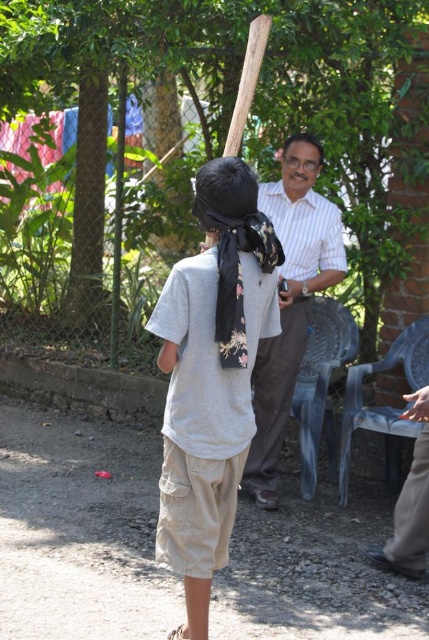
Between white striped shirt at center and wooden baseball bat at upper center, which one appears on the left side from the viewer's perspective?

wooden baseball bat at upper center is more to the left.

Who is taller, white striped shirt at center or wooden baseball bat at upper center?

Standing taller between the two is white striped shirt at center.

Find the location of a particular element. Image resolution: width=429 pixels, height=640 pixels. white striped shirt at center is located at coordinates (290, 300).

Find the location of a particular element. This screenshot has height=640, width=429. white striped shirt at center is located at coordinates (290, 300).

In order to click on gray cotton shirt at center in this screenshot , I will do `click(211, 378)`.

Who is positioned more to the right, gray cotton shirt at center or white striped shirt at center?

white striped shirt at center is more to the right.

Who is more distant from viewer, (230,163) or (257,442)?

The point (257,442) is behind.

Find the location of `gray cotton shirt at center`. gray cotton shirt at center is located at coordinates (211, 378).

Which is behind, point (199, 522) or point (250, 29)?

Positioned behind is point (250, 29).

What do you see at coordinates (211, 378) in the screenshot?
I see `gray cotton shirt at center` at bounding box center [211, 378].

This screenshot has height=640, width=429. Find the location of `gray cotton shirt at center`. gray cotton shirt at center is located at coordinates (211, 378).